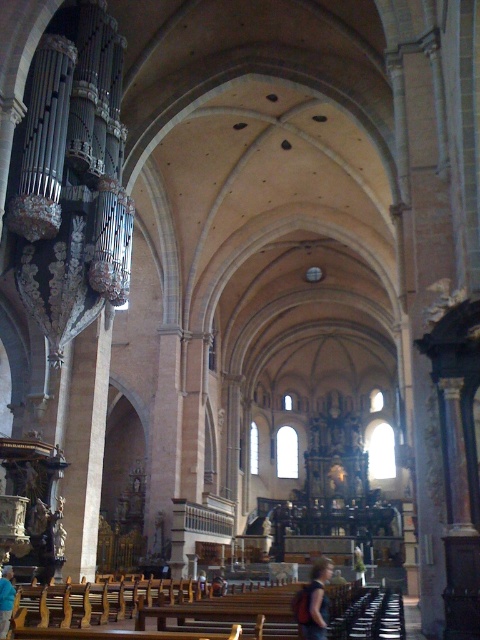
Question: Is dark brown leather jacket at lower center to the right of blue fabric shirt at lower left from the viewer's perspective?

Choices:
 (A) yes
 (B) no

Answer: (A)

Question: Which point appears farthest from the camera in this image?

Choices:
 (A) pyautogui.click(x=2, y=596)
 (B) pyautogui.click(x=325, y=621)

Answer: (A)

Question: Which point is closer to the camera?

Choices:
 (A) dark brown leather jacket at lower center
 (B) blue fabric shirt at lower left

Answer: (A)

Question: Which point is closer to the camera taking this photo?

Choices:
 (A) (296, 611)
 (B) (6, 632)

Answer: (B)

Question: Is dark brown leather jacket at lower center closer to camera compared to blue fabric shirt at lower left?

Choices:
 (A) yes
 (B) no

Answer: (A)

Question: Where is dark brown leather jacket at lower center located in relation to blue fabric shirt at lower left in the image?

Choices:
 (A) below
 (B) above

Answer: (A)